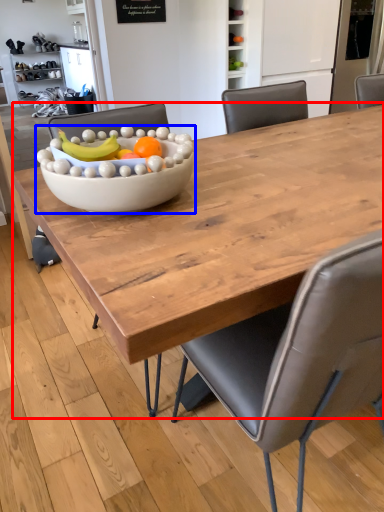
Question: Which object appears farthest to the camera in this image, coffee table (highlighted by a red box) or bowl (highlighted by a blue box)?

Choices:
 (A) coffee table
 (B) bowl

Answer: (B)